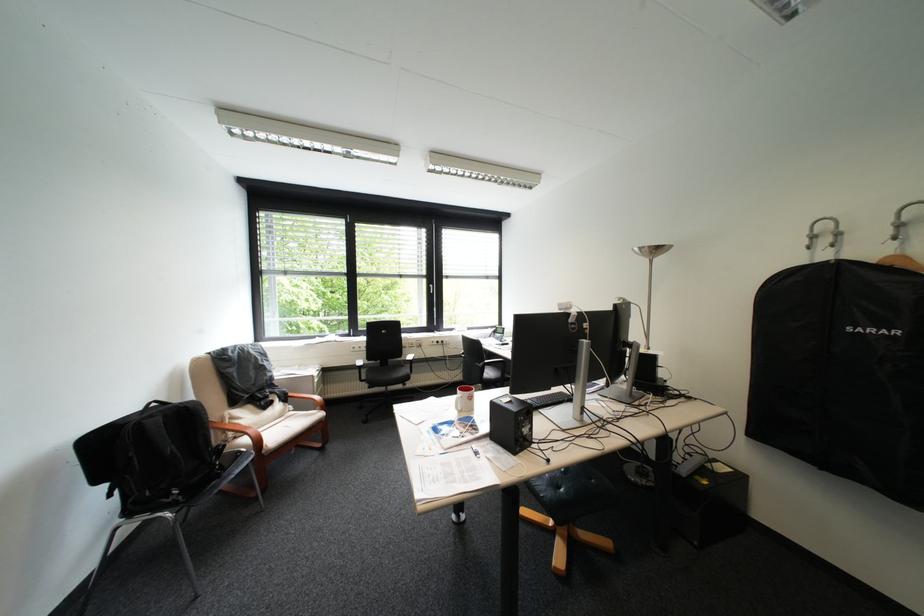
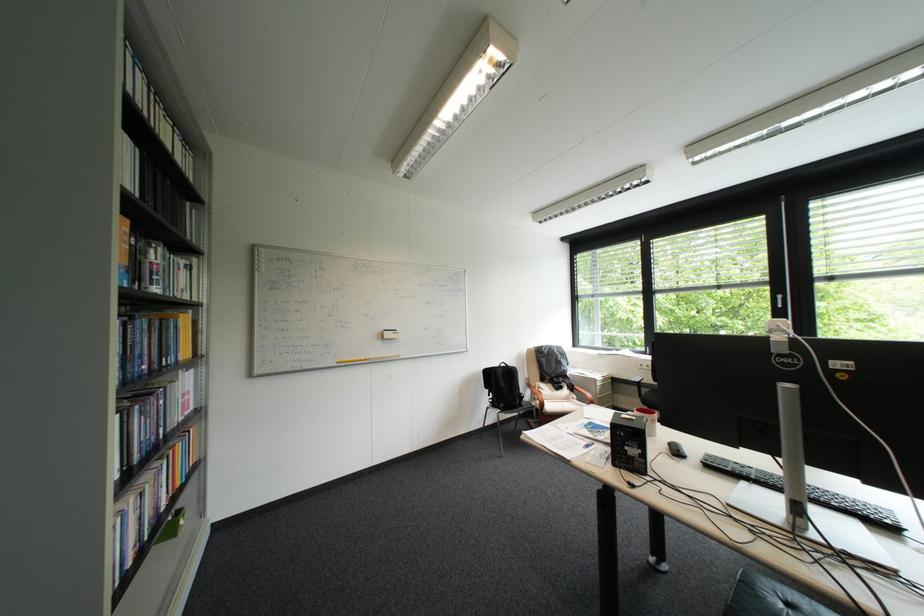
The point at (324, 377) is marked in the first image. Where is the corresponding point in the second image?

(608, 379)